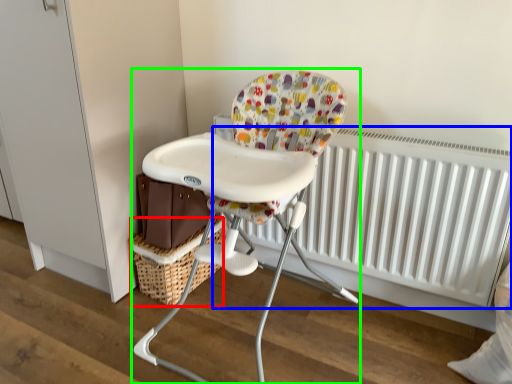
Question: Estimate the real-world distances between objects in this image. Which object is closer to basket (highlighted by a red box), radiator (highlighted by a blue box) or chair (highlighted by a green box)?

Choices:
 (A) radiator
 (B) chair

Answer: (B)